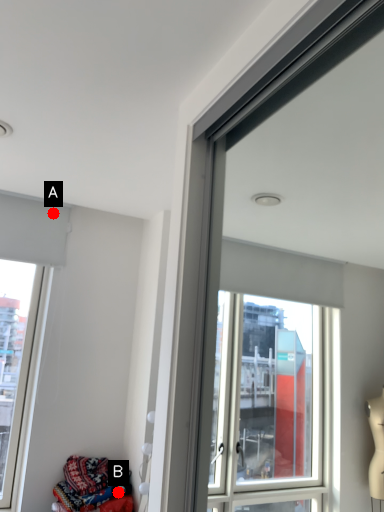
Question: Two points are circled on the image, labeled by A and B beside each circle. Among these points, which one is nearest to the camera?

Choices:
 (A) A is closer
 (B) B is closer

Answer: (B)